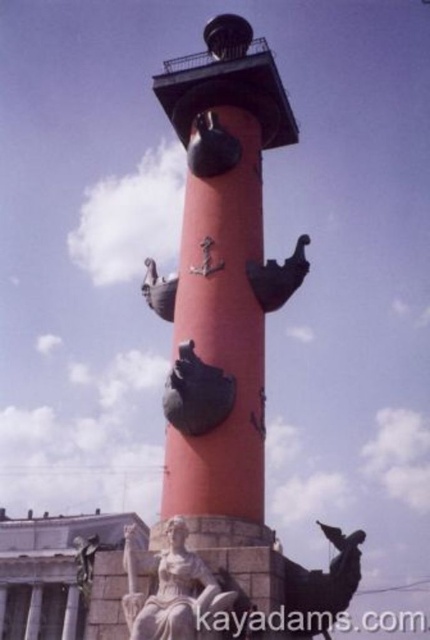
You are standing in front of the Rostral Column in Saint Petersburg. You notice two points marked on the column. The first point is located at coordinates point (355, 541), and the second point is at point (168, 372). If you were to reach out and touch both points, which one would require you to stretch your arm further away from your body?

Point (168, 372) requires stretching your arm further because it is closer to the camera than point (355, 541), meaning it is physically nearer to your position.

Based on the photo, you are a tourist standing at the entrance of the square facing the smooth red tower at center. You want to take a photo of the tower with the city skyline behind it. To do so, you need to move to the left or right side of the tower. Based on its position, which direction should you move to ensure the city skyline is visible behind the tower?

Since the smooth red tower at center is located at point coordinates, you should move to the left or right side to frame the city skyline behind it. However, without specific directional data, the best approach is to move to either side and check the view.

You are an art student visiting the Rostral Column in Saint Petersburg. You notice the bronze statue at lower right and the shiny bronze bird at center. Which object is positioned lower in the scene?

The bronze statue at lower right is positioned lower in the scene than the shiny bronze bird at center.